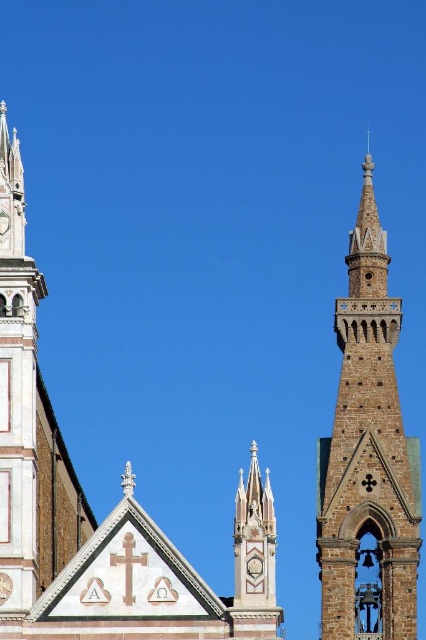
Based on the provided scene description, where is the white stone church at upper center located in the image?

The white stone church at upper center is located at point (89, 506) in the image.

You are standing in front of a historic cathedral and notice two structures above you. The white stone church at upper center and the white marble tower at left. Which one is positioned to the right of the other?

The white stone church at upper center is to the right of the white marble tower at left, so the white stone church at upper center is positioned to the right of the white marble tower at left.